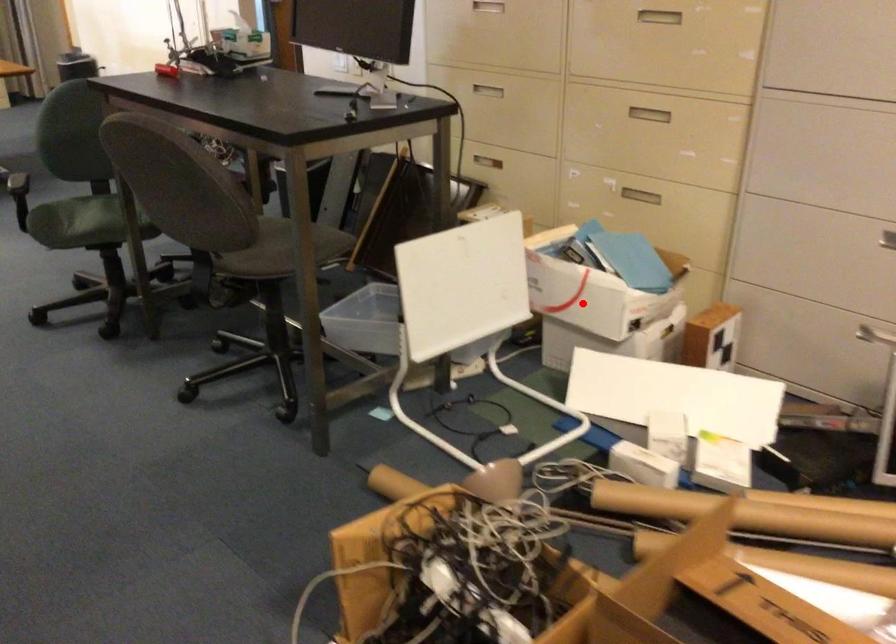
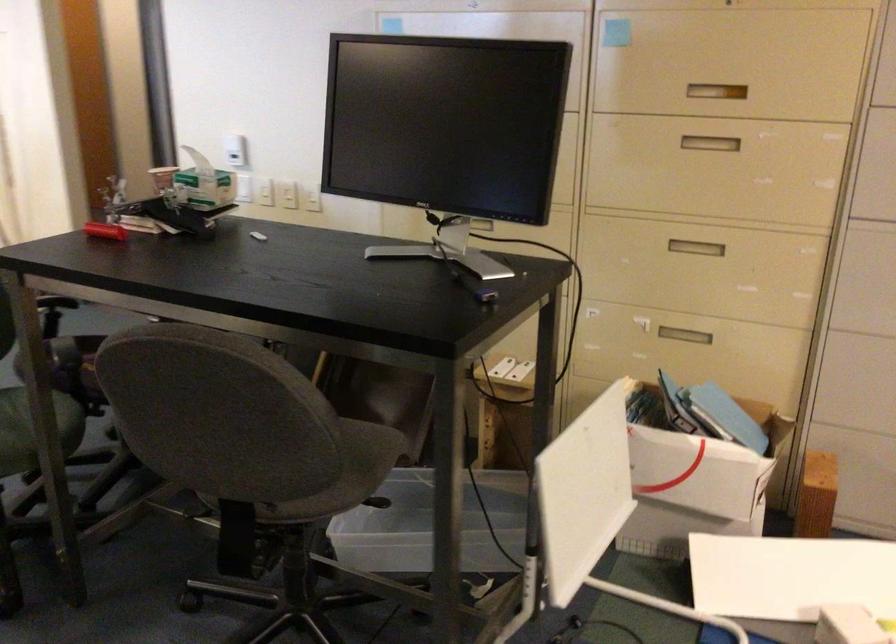
Locate, in the second image, the point that corresponds to the highlighted location in the first image.

(694, 484)